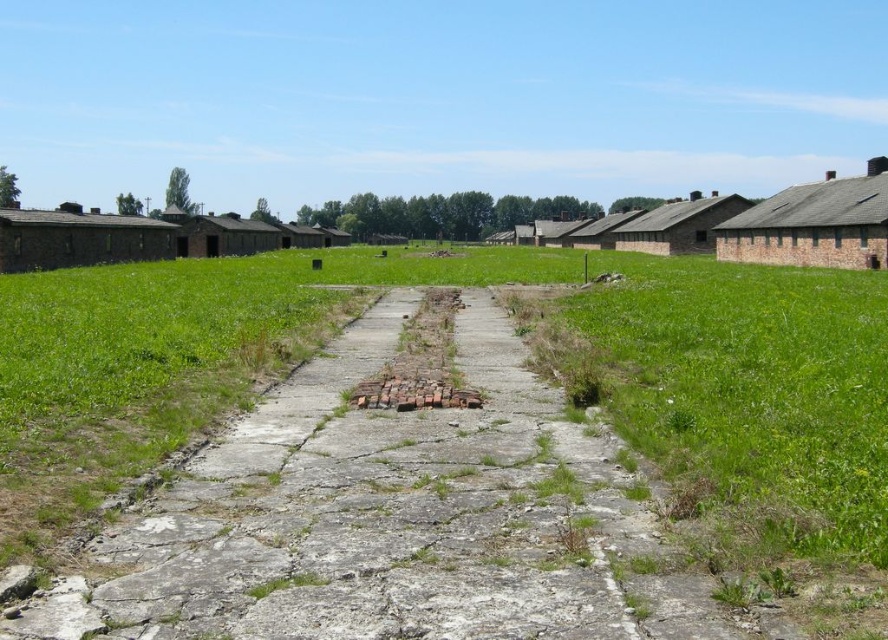
Question: Does brown brick hut at right come behind brown brick hut at center?

Choices:
 (A) yes
 (B) no

Answer: (A)

Question: Is brown brick hut at left below brown brick hut at right?

Choices:
 (A) yes
 (B) no

Answer: (A)

Question: Is brown brick hut at right to the right of brown brick hut at center from the viewer's perspective?

Choices:
 (A) yes
 (B) no

Answer: (A)

Question: Estimate the real-world distances between objects in this image. Which object is closer to the brown brick hut at right?

Choices:
 (A) brown brick hut at center
 (B) brown brick hut at left
 (C) brown brick hut at upper right

Answer: (C)

Question: Based on their relative distances, which object is nearer to the brown brick hut at left?

Choices:
 (A) brown brick hut at center
 (B) brown brick hut at upper right
 (C) brown brick hut at right

Answer: (A)

Question: Among these points, which one is farthest from the camera?

Choices:
 (A) (847, 211)
 (B) (710, 228)

Answer: (B)